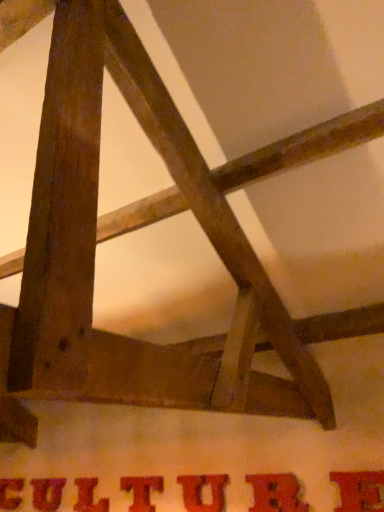
Question: Is matte red letter at center, which is the third letter in left-to-right order, closer to camera compared to matte brown letter t at center, the 4th letter in the left-to-right sequence?

Choices:
 (A) no
 (B) yes

Answer: (A)

Question: Can you confirm if matte red letter at center, marked as the fifth letter in a right-to-left arrangement, is smaller than matte brown letter t at center, which appears as the 4th letter when viewed from the right?

Choices:
 (A) no
 (B) yes

Answer: (B)

Question: From the image's perspective, is matte red letter at center, which is the third letter in left-to-right order, over matte brown letter t at center, which appears as the 4th letter when viewed from the right?

Choices:
 (A) yes
 (B) no

Answer: (B)

Question: Is matte red letter at center, which is the third letter in left-to-right order, outside matte brown letter t at center, which appears as the 4th letter when viewed from the right?

Choices:
 (A) yes
 (B) no

Answer: (A)

Question: Does matte red letter at center, marked as the fifth letter in a right-to-left arrangement, have a lesser height compared to matte brown letter t at center, which appears as the 4th letter when viewed from the right?

Choices:
 (A) yes
 (B) no

Answer: (B)

Question: In the image, is matte red letter at center, which is the sixth letter from left to right, positioned in front of or behind matte red letter at center, which is counted as the fifth letter, starting from the left?

Choices:
 (A) behind
 (B) front

Answer: (B)

Question: Choose the correct answer: Is matte red letter at center, which is the second letter in right-to-left order, inside matte red letter at center, which is counted as the fifth letter, starting from the left, or outside it?

Choices:
 (A) inside
 (B) outside

Answer: (B)

Question: Would you say matte red letter at center, which is the second letter in right-to-left order, is to the left or to the right of matte red letter at center, which is counted as the fifth letter, starting from the left, in the picture?

Choices:
 (A) right
 (B) left

Answer: (A)

Question: Based on their sizes in the image, would you say matte red letter at center, which is the sixth letter from left to right, is bigger or smaller than matte red letter at center, which is the third letter in right-to-left order?

Choices:
 (A) small
 (B) big

Answer: (B)

Question: Would you say matte red letter at center, which is the third letter in left-to-right order, is inside or outside matte red letter at center, which is counted as the fifth letter, starting from the left?

Choices:
 (A) outside
 (B) inside

Answer: (A)

Question: Relative to matte red letter at center, which is counted as the fifth letter, starting from the left, is matte red letter at center, marked as the fifth letter in a right-to-left arrangement, in front or behind?

Choices:
 (A) behind
 (B) front

Answer: (A)

Question: In terms of height, does matte red letter at center, marked as the fifth letter in a right-to-left arrangement, look taller or shorter compared to matte red letter at center, which is counted as the fifth letter, starting from the left?

Choices:
 (A) tall
 (B) short

Answer: (B)

Question: Is matte red letter at center, which is the third letter in left-to-right order, wider or thinner than matte red letter at center, which is the third letter in right-to-left order?

Choices:
 (A) thin
 (B) wide

Answer: (B)

Question: Considering their positions, is matte red letter at center, which is the sixth letter from left to right, located in front of or behind matte brown letter t at center, which appears as the 4th letter when viewed from the right?

Choices:
 (A) front
 (B) behind

Answer: (A)

Question: Choose the correct answer: Is matte red letter at center, which is the second letter in right-to-left order, inside matte brown letter t at center, the 4th letter in the left-to-right sequence, or outside it?

Choices:
 (A) inside
 (B) outside

Answer: (B)